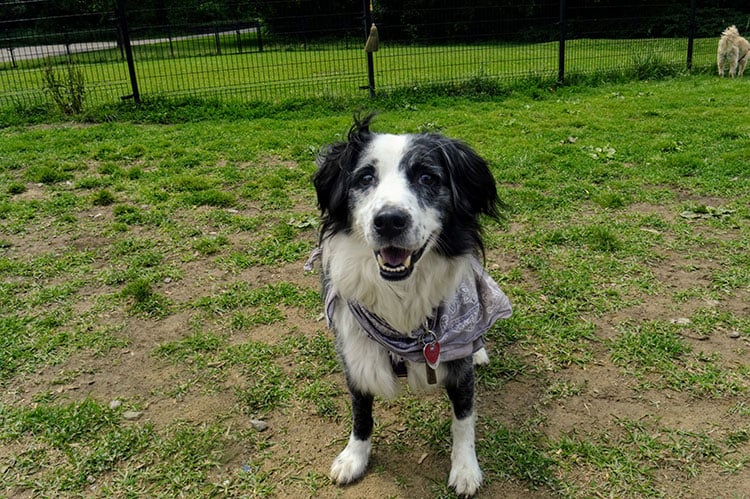
The height and width of the screenshot is (499, 750). In order to click on broom in this screenshot , I will do `click(370, 41)`.